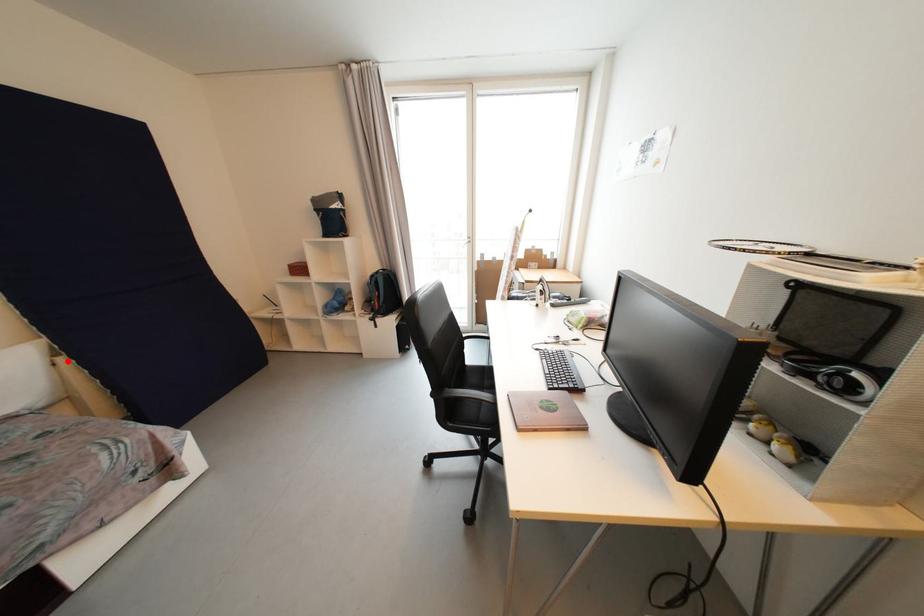
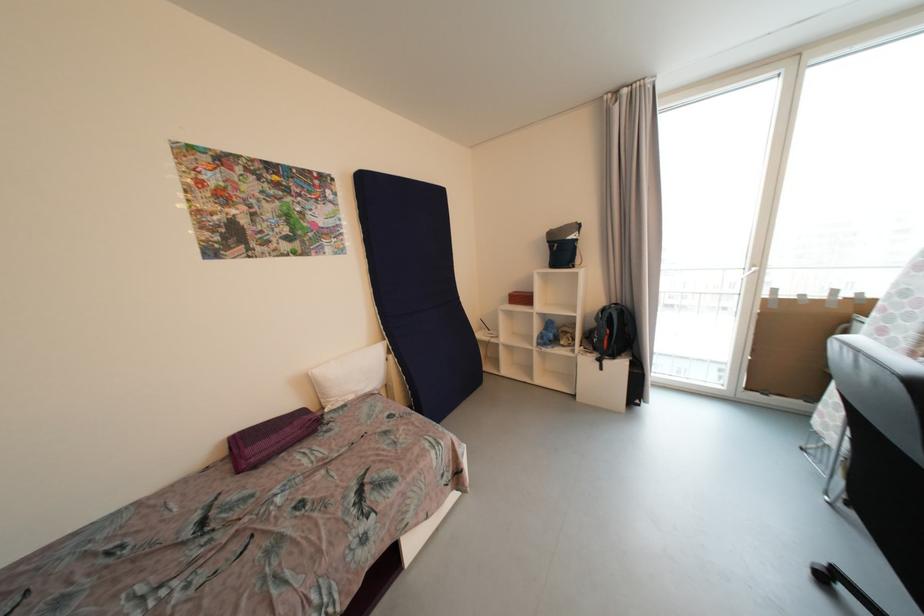
The point at the highlighted location is marked in the first image. Where is the corresponding point in the second image?

(396, 359)